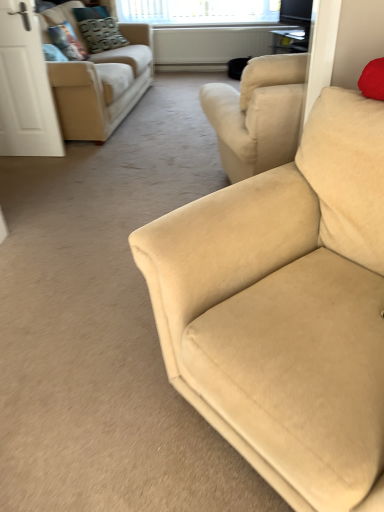
The image size is (384, 512). I want to click on velvet textured pillow at upper left, the 2th pillow from the front, so click(x=101, y=34).

Where is `beige fabric couch at upper left, acting as the second studio couch starting from the front`? This screenshot has height=512, width=384. beige fabric couch at upper left, acting as the second studio couch starting from the front is located at coordinates (102, 86).

What is the approximate height of clear glass window at upper center?

clear glass window at upper center is 10.94 inches tall.

Measure the distance between point (162, 243) and camera.

The distance of point (162, 243) from camera is 1.17 meters.

I want to click on white matte door at left, so click(25, 87).

Could you tell me if velvet textured pillow at upper left, which is counted as the 2th pillow, starting from the back, is turned towards velvet textured pillow at upper left, the 2th pillow from the front?

No, velvet textured pillow at upper left, which is counted as the 2th pillow, starting from the back, is not turned towards velvet textured pillow at upper left, the 2th pillow from the front.

Considering the relative sizes of velvet textured pillow at upper left, positioned as the 1th pillow in front-to-back order, and velvet textured pillow at upper left, the first pillow positioned from the back, in the image provided, is velvet textured pillow at upper left, positioned as the 1th pillow in front-to-back order, taller than velvet textured pillow at upper left, the first pillow positioned from the back,?

Correct, velvet textured pillow at upper left, positioned as the 1th pillow in front-to-back order, is much taller as velvet textured pillow at upper left, the first pillow positioned from the back.

The height and width of the screenshot is (512, 384). Identify the location of pillow in front of the velvet textured pillow at upper left, the 2th pillow from the front. (67, 41).

Is velvet textured pillow at upper left, positioned as the 1th pillow in front-to-back order, not inside velvet textured pillow at upper left, the 2th pillow from the front?

Yes.

Is velvet textured pillow at upper left, positioned as the 1th pillow in front-to-back order, at the back of white matte door at left?

Correct, white matte door at left is looking away from velvet textured pillow at upper left, positioned as the 1th pillow in front-to-back order.

Considering the positions of point (17, 89) and point (62, 42), is point (17, 89) closer or farther from the camera than point (62, 42)?

Point (17, 89) appears to be closer to the viewer than point (62, 42).

Which is more to the left, white matte door at left or velvet textured pillow at upper left, which is counted as the 2th pillow, starting from the back?

Positioned to the left is white matte door at left.

Is white matte door at left completely or partially outside of velvet textured pillow at upper left, positioned as the 1th pillow in front-to-back order?

Yes, white matte door at left is outside of velvet textured pillow at upper left, positioned as the 1th pillow in front-to-back order.

Is velvet textured pillow at upper left, which is counted as the 2th pillow, starting from the back, directly adjacent to white matte door at left?

velvet textured pillow at upper left, which is counted as the 2th pillow, starting from the back, and white matte door at left are clearly separated.

Which object is more forward, velvet textured pillow at upper left, which is counted as the 2th pillow, starting from the back, or white matte door at left?

white matte door at left.

From the image's perspective, is velvet textured pillow at upper left, which is counted as the 2th pillow, starting from the back, under white matte door at left?

Incorrect, from the image's perspective, velvet textured pillow at upper left, which is counted as the 2th pillow, starting from the back, is higher than white matte door at left.

Would you say velvet textured pillow at upper left, which is counted as the 2th pillow, starting from the back, is outside white matte door at left?

Yes, velvet textured pillow at upper left, which is counted as the 2th pillow, starting from the back, is not within white matte door at left.

Is white matte door at left to the left of clear glass window at upper center from the viewer's perspective?

Correct, you'll find white matte door at left to the left of clear glass window at upper center.

Are white matte door at left and clear glass window at upper center located far from each other?

white matte door at left is positioned a significant distance from clear glass window at upper center.

Considering the positions of point (30, 101) and point (266, 18), is point (30, 101) closer or farther from the camera than point (266, 18)?

Point (30, 101) is closer to the camera than point (266, 18).

The width and height of the screenshot is (384, 512). In order to click on window lying on the right of white matte door at left in this screenshot , I will do `click(198, 12)`.

Would you consider beige fabric couch at right, the second studio couch viewed from the left, to be distant from white matte door at left?

Yes.

Which of these two, beige fabric couch at right, which is the second studio couch in back-to-front order, or white matte door at left, stands taller?

white matte door at left.

Is point (302, 390) positioned in front of point (23, 127)?

Yes, it is.

In the scene shown: From the image's perspective, does beige fabric couch at right, which is the second studio couch in back-to-front order, appear lower than white matte door at left?

Yes.

Between clear glass window at upper center and beige fabric couch at upper left, the 1th studio couch viewed from the top, which one has larger size?

beige fabric couch at upper left, the 1th studio couch viewed from the top.

Which is in front, clear glass window at upper center or beige fabric couch at upper left, the second studio couch from the bottom?

Positioned in front is beige fabric couch at upper left, the second studio couch from the bottom.

From the image's perspective, relative to beige fabric couch at upper left, the second studio couch from the bottom, is clear glass window at upper center above or below?

clear glass window at upper center is situated higher than beige fabric couch at upper left, the second studio couch from the bottom, in the image.

Is beige fabric couch at upper left, the 1th studio couch from the left, a part of clear glass window at upper center?

Definitely not — beige fabric couch at upper left, the 1th studio couch from the left, is not inside clear glass window at upper center.

Considering the points (265, 2) and (120, 38), which point is behind, point (265, 2) or point (120, 38)?

The point (265, 2) is farther.

You are a GUI agent. You are given a task and a screenshot of the screen. Output one action in this format:
    pyautogui.click(x=<x>, y=<y>)
    Task: Click on the window on the right of velvet textured pillow at upper left, the first pillow positioned from the back
    The image size is (384, 512).
    Given the screenshot: What is the action you would take?
    pyautogui.click(x=198, y=12)

From the image's perspective, which is above, clear glass window at upper center or velvet textured pillow at upper left, the first pillow positioned from the back?

From the image's view, clear glass window at upper center is above.

Would you say clear glass window at upper center is a long distance from velvet textured pillow at upper left, the 2th pillow from the front?

Actually, clear glass window at upper center and velvet textured pillow at upper left, the 2th pillow from the front, are a little close together.

Where is `pillow located above the velvet textured pillow at upper left, the 2th pillow from the front (from a real-world perspective)`? This screenshot has height=512, width=384. pillow located above the velvet textured pillow at upper left, the 2th pillow from the front (from a real-world perspective) is located at coordinates (67, 41).

You are a GUI agent. You are given a task and a screenshot of the screen. Output one action in this format:
    pyautogui.click(x=<x>, y=<y>)
    Task: Click on the 1st pillow behind the white matte door at left
    The image size is (384, 512).
    Given the screenshot: What is the action you would take?
    pyautogui.click(x=67, y=41)

When comparing their distances from velvet textured pillow at upper left, positioned as the 1th pillow in front-to-back order, does beige fabric couch at right, the first studio couch in the front-to-back sequence, or beige fabric couch at upper left, the 1th studio couch viewed from the top, seem further?

Based on the image, beige fabric couch at right, the first studio couch in the front-to-back sequence, appears to be further to velvet textured pillow at upper left, positioned as the 1th pillow in front-to-back order.

Considering their positions, is beige fabric couch at upper left, the 1th studio couch viewed from the top, positioned further to velvet textured pillow at upper left, positioned as the 1th pillow in front-to-back order, than beige fabric couch at right, the first studio couch in the right-to-left sequence?

→ The object further to velvet textured pillow at upper left, positioned as the 1th pillow in front-to-back order, is beige fabric couch at right, the first studio couch in the right-to-left sequence.

Which object lies further to the anchor point beige fabric couch at right, placed as the second studio couch when sorted from top to bottom, clear glass window at upper center or velvet textured pillow at upper left, the first pillow positioned from the back?

clear glass window at upper center is positioned further to the anchor beige fabric couch at right, placed as the second studio couch when sorted from top to bottom.

Estimate the real-world distances between objects in this image. Which object is closer to beige fabric couch at right, placed as the second studio couch when sorted from top to bottom, clear glass window at upper center or white matte door at left?

The object closer to beige fabric couch at right, placed as the second studio couch when sorted from top to bottom, is white matte door at left.

Estimate the real-world distances between objects in this image. Which object is closer to white matte door at left, velvet textured pillow at upper left, the first pillow positioned from the back, or velvet textured pillow at upper left, which is counted as the 2th pillow, starting from the back?

velvet textured pillow at upper left, which is counted as the 2th pillow, starting from the back, lies closer to white matte door at left than the other object.

Considering their positions, is velvet textured pillow at upper left, the first pillow positioned from the back, positioned closer to white matte door at left than beige fabric couch at upper left, the 1th studio couch from the left?

Among the two, beige fabric couch at upper left, the 1th studio couch from the left, is located nearer to white matte door at left.

Based on their spatial positions, is beige fabric couch at right, the first studio couch in the front-to-back sequence, or white matte door at left closer to clear glass window at upper center?

white matte door at left is closer to clear glass window at upper center.

When comparing their distances from beige fabric couch at upper left, acting as the second studio couch starting from the front, does velvet textured pillow at upper left, positioned as the 1th pillow in front-to-back order, or white matte door at left seem closer?

The object closer to beige fabric couch at upper left, acting as the second studio couch starting from the front, is white matte door at left.

Locate an element on the screen. This screenshot has width=384, height=512. screen door between beige fabric couch at right, which is the 1th studio couch from bottom to top, and clear glass window at upper center in the front-back direction is located at coordinates (25, 87).

Image resolution: width=384 pixels, height=512 pixels. I want to click on pillow positioned between beige fabric couch at upper left, the 1th studio couch from the left, and velvet textured pillow at upper left, the first pillow positioned from the back, from near to far, so click(x=67, y=41).

You are a GUI agent. You are given a task and a screenshot of the screen. Output one action in this format:
    pyautogui.click(x=<x>, y=<y>)
    Task: Click on the studio couch located between white matte door at left and velvet textured pillow at upper left, the first pillow positioned from the back, in the depth direction
    The width and height of the screenshot is (384, 512).
    Given the screenshot: What is the action you would take?
    pyautogui.click(x=102, y=86)

The width and height of the screenshot is (384, 512). In order to click on pillow located between white matte door at left and velvet textured pillow at upper left, the 2th pillow from the front, in the depth direction in this screenshot , I will do `click(67, 41)`.